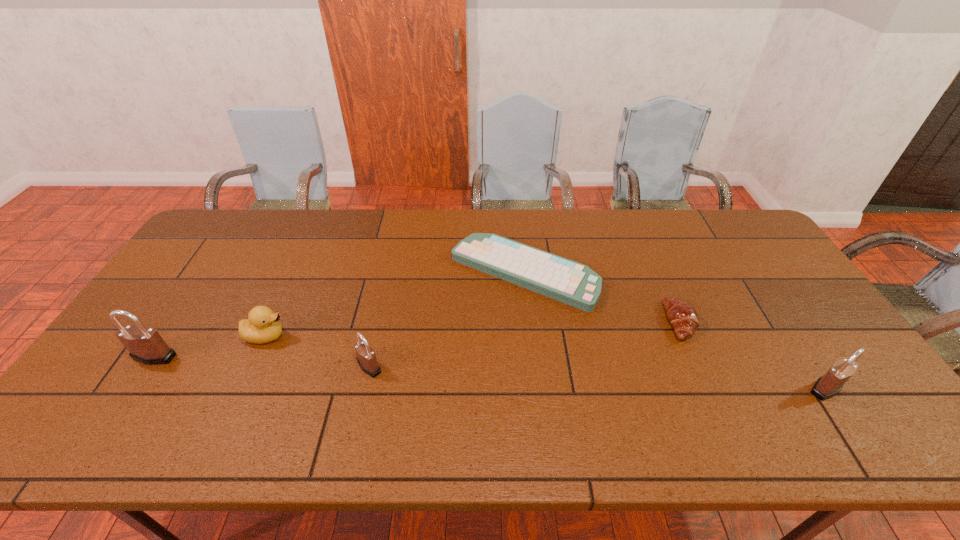
Identify the location of free space that is in between the second tallest object and the third shortest object. The width and height of the screenshot is (960, 540). (546, 362).

This screenshot has width=960, height=540. Identify the location of empty space between the second object from left to right and the shortest padlock. (318, 351).

The image size is (960, 540). Identify the location of vacant space in between the second padlock from right to left and the leftmost padlock. (262, 361).

I want to click on vacant space that's between the second object from left to right and the crescent roll, so click(473, 328).

The width and height of the screenshot is (960, 540). I want to click on object that stands as the fourth closest to the leftmost padlock, so click(681, 314).

You are a GUI agent. You are given a task and a screenshot of the screen. Output one action in this format:
    pyautogui.click(x=<x>, y=<y>)
    Task: Click on the object that is the fifth nearest to the shortest object
    This screenshot has width=960, height=540.
    Given the screenshot: What is the action you would take?
    pyautogui.click(x=145, y=344)

Identify the location of padlock that is the closest to the shortest object. (366, 358).

Select which padlock is the closest to the second object from left to right. Please provide its 2D coordinates. Your answer should be formatted as a tuple, i.e. [(x, y)], where the tuple contains the x and y coordinates of a point satisfying the conditions above.

[(145, 344)]

Locate an element on the screen. The image size is (960, 540). vacant space that satisfies the following two spatial constraints: 1. on the face of the duckling; 2. on the front side of the leftmost object is located at coordinates (256, 356).

This screenshot has height=540, width=960. Find the location of `vacant region that satisfies the following two spatial constraints: 1. on the face of the fourth tallest object; 2. on the back side of the second padlock from right to left`. vacant region that satisfies the following two spatial constraints: 1. on the face of the fourth tallest object; 2. on the back side of the second padlock from right to left is located at coordinates (252, 367).